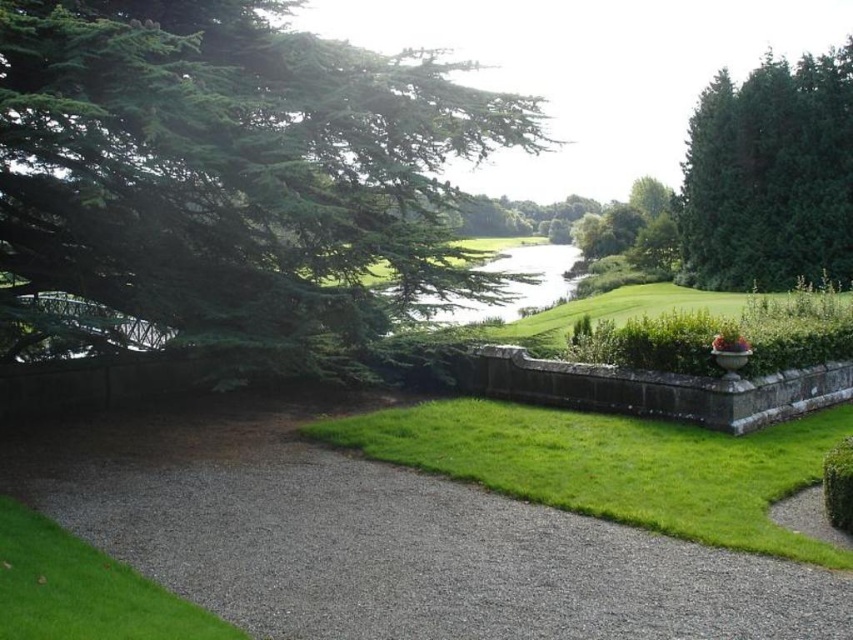
Who is positioned more to the right, gray gravel path at center or green grass at lower left?

gray gravel path at center is more to the right.

Is point (590, 589) farther from viewer compared to point (20, 547)?

No, it is not.

Locate an element on the screen. This screenshot has width=853, height=640. gray gravel path at center is located at coordinates (392, 545).

Is gray gravel path at center in front of green leafy hedge at lower right?

Yes, it is in front of green leafy hedge at lower right.

Does gray gravel path at center appear over green leafy hedge at lower right?

Actually, gray gravel path at center is below green leafy hedge at lower right.

I want to click on gray gravel path at center, so click(x=392, y=545).

Locate an element on the screen. This screenshot has height=640, width=853. gray gravel path at center is located at coordinates (392, 545).

You are a GUI agent. You are given a task and a screenshot of the screen. Output one action in this format:
    pyautogui.click(x=<x>, y=<y>)
    Task: Click on the dark green textured tree at upper right
    The image size is (853, 640).
    Given the screenshot: What is the action you would take?
    pyautogui.click(x=769, y=177)

Is dark green textured tree at upper right positioned in front of green grass at lower left?

No, dark green textured tree at upper right is further to the viewer.

Does point (761, 108) lie behind point (120, 632)?

Yes, point (761, 108) is behind point (120, 632).

At what (x,y) coordinates should I click in order to perform the action: click on dark green textured tree at upper right. Please return your answer as a coordinate pair (x, y). This screenshot has width=853, height=640. Looking at the image, I should click on (769, 177).